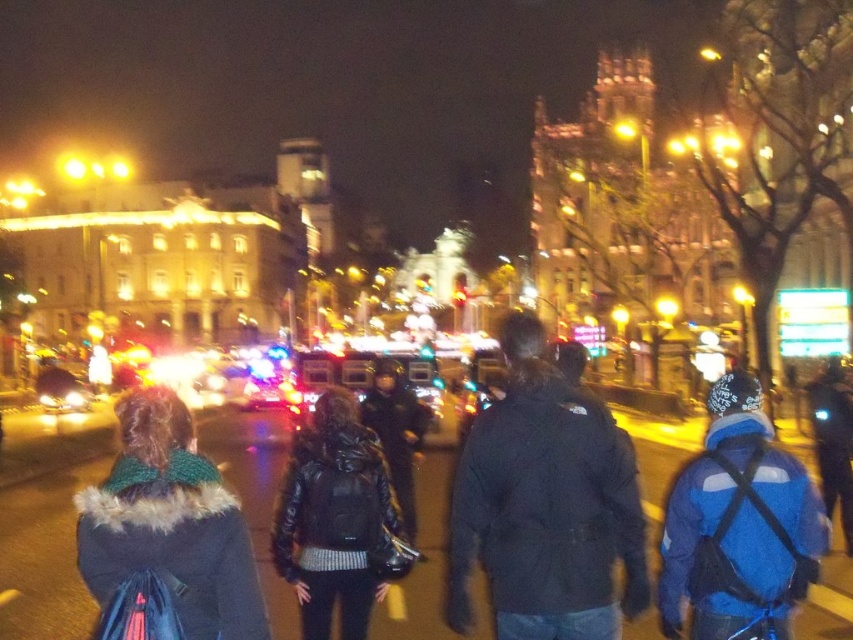
Question: Which point appears closest to the camera in this image?

Choices:
 (A) (347, 448)
 (B) (532, 378)
 (C) (212, 520)
 (D) (805, 525)

Answer: (C)

Question: Does black matte jacket at center have a larger size compared to fuzzy green scarf at lower left?

Choices:
 (A) no
 (B) yes

Answer: (B)

Question: Which object appears farthest from the camera in this image?

Choices:
 (A) black leather jacket at center
 (B) fuzzy green scarf at lower left
 (C) blue matte jacket at lower right

Answer: (A)

Question: Is black matte jacket at center below black leather jacket at center?

Choices:
 (A) yes
 (B) no

Answer: (B)

Question: Can you confirm if blue matte jacket at lower right is wider than black leather jacket at center?

Choices:
 (A) yes
 (B) no

Answer: (A)

Question: Which object is closer to the camera taking this photo?

Choices:
 (A) fuzzy green scarf at lower left
 (B) black matte jacket at center
 (C) black leather jacket at center
 (D) blue matte jacket at lower right

Answer: (A)